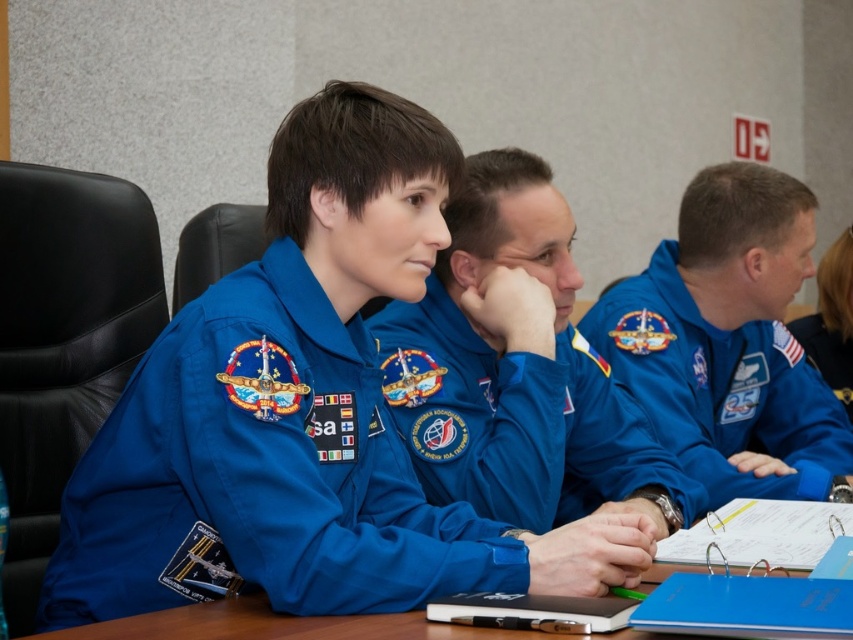
Is point (524, 493) closer to viewer compared to point (689, 289)?

Yes, it is in front of point (689, 289).

Does blue fabric uniform at center come behind blue fabric jacket at center?

No, it is not.

At what (x,y) coordinates should I click in order to perform the action: click on blue fabric uniform at center. Please return your answer as a coordinate pair (x, y). The height and width of the screenshot is (640, 853). Looking at the image, I should click on (517, 374).

Where is `blue fabric uniform at center`? The image size is (853, 640). blue fabric uniform at center is located at coordinates (517, 374).

Does blue fabric uniform at center have a larger size compared to wooden table at center?

Yes, blue fabric uniform at center is bigger than wooden table at center.

From the picture: Can you confirm if blue fabric uniform at center is thinner than wooden table at center?

Indeed, blue fabric uniform at center has a lesser width compared to wooden table at center.

You are a GUI agent. You are given a task and a screenshot of the screen. Output one action in this format:
    pyautogui.click(x=<x>, y=<y>)
    Task: Click on the blue fabric uniform at center
    The height and width of the screenshot is (640, 853).
    Given the screenshot: What is the action you would take?
    (517, 374)

Locate an element on the screen. The width and height of the screenshot is (853, 640). blue fabric uniform at center is located at coordinates (517, 374).

Is blue fabric jacket at center bigger than wooden table at center?

Yes.

Does blue fabric jacket at center appear over wooden table at center?

Correct, blue fabric jacket at center is located above wooden table at center.

This screenshot has height=640, width=853. Identify the location of blue fabric jacket at center. (729, 340).